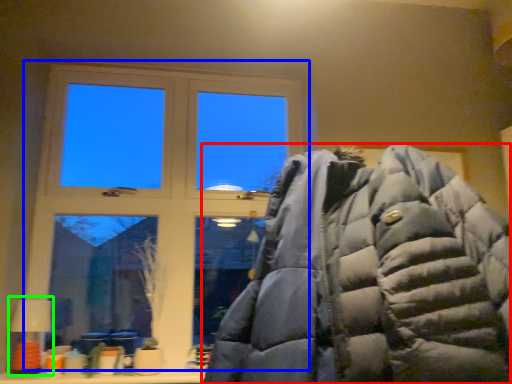
Question: Estimate the real-world distances between objects in this image. Which object is farther from jacket (highlighted by a red box), window (highlighted by a blue box) or table lamp (highlighted by a green box)?

Choices:
 (A) window
 (B) table lamp

Answer: (B)